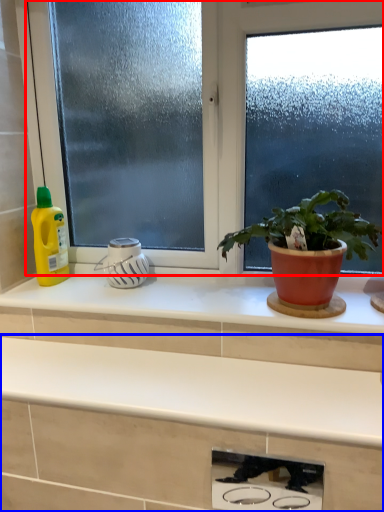
Question: Which point is further to the camera, window (highlighted by a red box) or countertop (highlighted by a blue box)?

Choices:
 (A) window
 (B) countertop

Answer: (A)